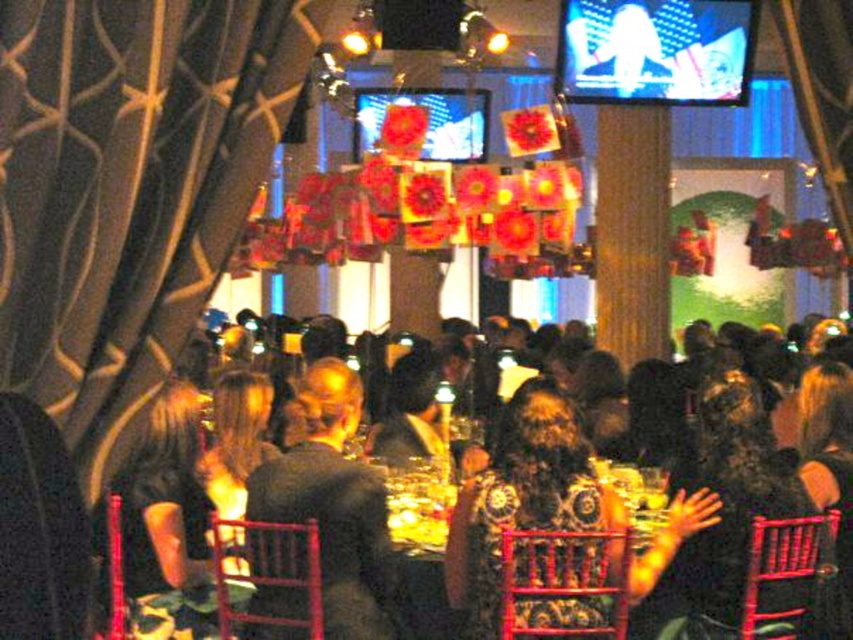
You are standing at the entrance of the event hall and want to locate the dark hair at center. According to the coordinate system where the bottom left corner is the origin, can you determine if the point at (317, 522) would be a good indicator of its location?

The point at (317, 522) is on the dark hair at center, so yes, it is a good indicator of its location.

You are standing at the point labeled as point (x=328, y=381) in the image. You want to walk to the point labeled as point (x=705, y=403). Which direction should you move in relation to the scene?

You should move towards the back of the scene because point (x=705, y=403) is behind point (x=328, y=381).

You are a photographer at the event and want to capture a photo of the dark hair at center and dark gray suit at center. Which object should you focus on first if you want to include both in the frame without moving the camera?

The dark hair at center is located below the dark gray suit at center, so you should focus on the dark gray suit at center first to ensure both are in the frame.